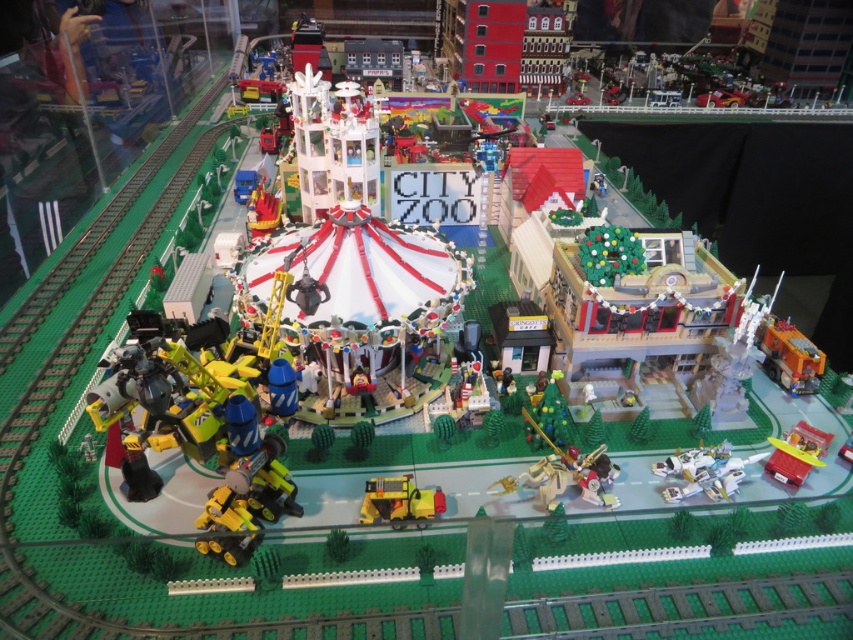
Question: Which point appears closest to the camera in this image?

Choices:
 (A) (781, 474)
 (B) (428, 506)
 (C) (553, 483)
 (D) (705, 490)

Answer: (B)

Question: Is white plastic airplane at lower right bigger than yellow matte truck at center?

Choices:
 (A) yes
 (B) no

Answer: (B)

Question: Can you confirm if gold metallic horse at center is smaller than translucent yellow airplane at lower right?

Choices:
 (A) no
 (B) yes

Answer: (A)

Question: Which of the following is the farthest from the observer?

Choices:
 (A) yellow matte truck at center
 (B) gold metallic horse at center
 (C) white plastic airplane at lower right
 (D) translucent yellow airplane at lower right

Answer: (D)

Question: Where is white plastic airplane at lower right located in relation to yellow matte truck at center in the image?

Choices:
 (A) right
 (B) left

Answer: (A)

Question: Which point is closer to the camera?

Choices:
 (A) (767, 467)
 (B) (566, 483)

Answer: (B)